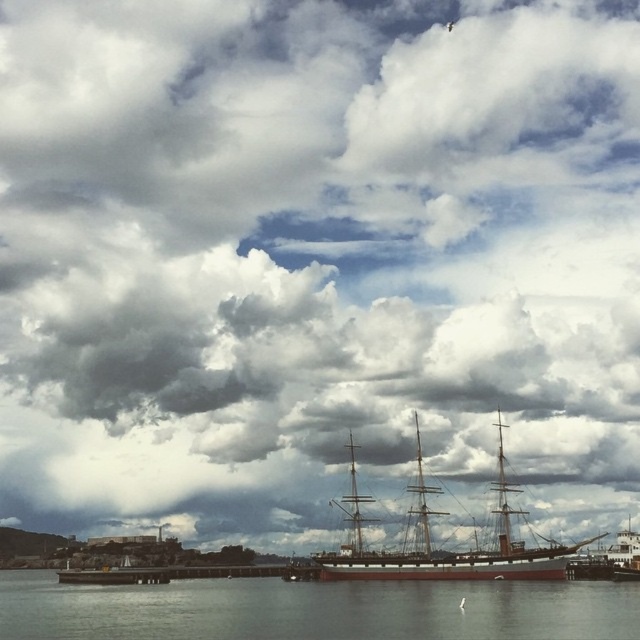
Question: Which point is closer to the camera taking this photo?

Choices:
 (A) (237, 620)
 (B) (490, 552)

Answer: (A)

Question: Does clear water at lower center have a larger size compared to wooden ship at center?

Choices:
 (A) yes
 (B) no

Answer: (A)

Question: Which point is farther to the camera?

Choices:
 (A) wooden ship at center
 (B) clear water at lower center

Answer: (A)

Question: Which of the following is the farthest from the observer?

Choices:
 (A) 499,458
 (B) 426,592

Answer: (A)

Question: Is clear water at lower center closer to the viewer compared to wooden ship at center?

Choices:
 (A) no
 (B) yes

Answer: (B)

Question: Where is clear water at lower center located in relation to wooden ship at center in the image?

Choices:
 (A) left
 (B) right

Answer: (A)